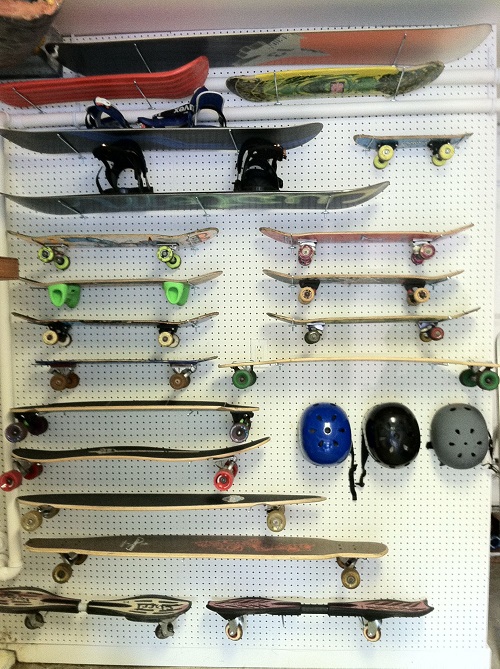
Where is `celing`? The image size is (500, 669). celing is located at coordinates (103, 9).